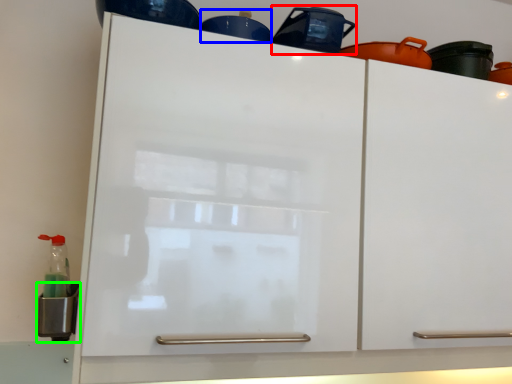
Question: Estimate the real-world distances between objects in this image. Which object is farther from appliance (highlighted by a red box), appliance (highlighted by a blue box) or appliance (highlighted by a green box)?

Choices:
 (A) appliance
 (B) appliance

Answer: (B)